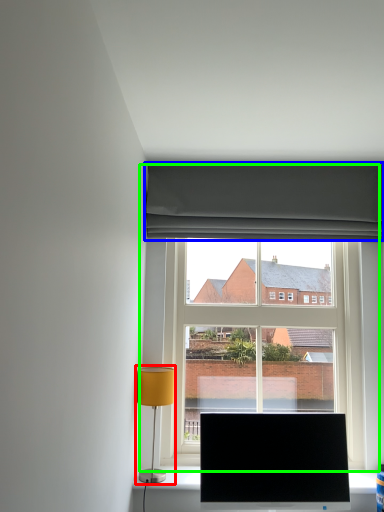
Question: Considering the real-world distances, which object is farthest from table lamp (highlighted by a red box)? curtain (highlighted by a blue box) or window (highlighted by a green box)?

Choices:
 (A) curtain
 (B) window

Answer: (A)